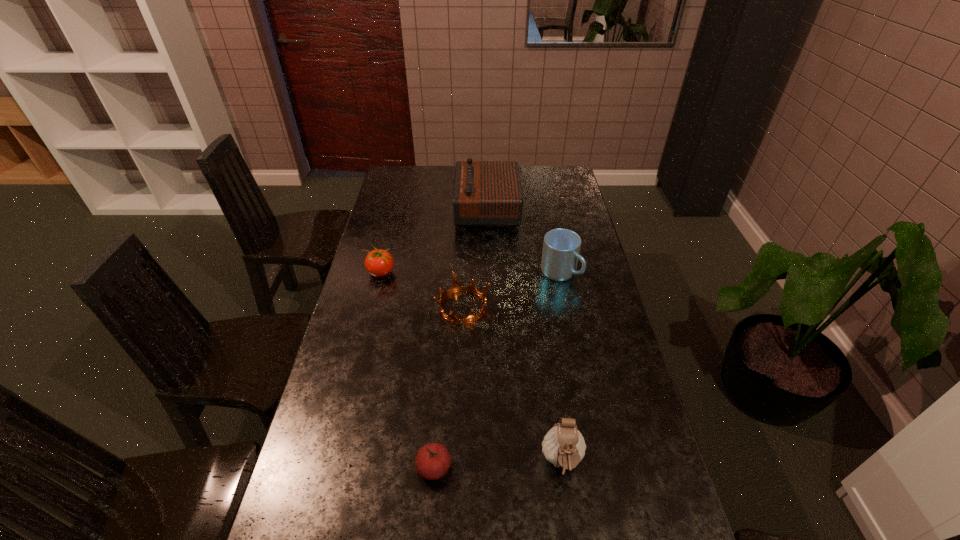
Identify the location of free space that is in between the mug and the tallest object. (523, 241).

Find the location of `vacant area between the tallest object and the pouch`. vacant area between the tallest object and the pouch is located at coordinates (524, 335).

Locate an element on the screen. unoccupied area between the mug and the crown is located at coordinates (512, 289).

You are a GUI agent. You are given a task and a screenshot of the screen. Output one action in this format:
    pyautogui.click(x=<x>, y=<y>)
    Task: Click on the second closest object to the crown
    This screenshot has height=540, width=960.
    Given the screenshot: What is the action you would take?
    pyautogui.click(x=561, y=247)

You are a GUI agent. You are given a task and a screenshot of the screen. Output one action in this format:
    pyautogui.click(x=<x>, y=<y>)
    Task: Click on the object that is the third closest to the tallest object
    The image size is (960, 540).
    Given the screenshot: What is the action you would take?
    (x=456, y=287)

Locate an element on the screen. The width and height of the screenshot is (960, 540). blank area in the image that satisfies the following two spatial constraints: 1. on the back side of the shorter tomato; 2. on the left side of the mug is located at coordinates (449, 273).

Find the location of `vacant area in the image that satisfies the following two spatial constraints: 1. on the front panel of the radio receiver; 2. on the right side of the mug`. vacant area in the image that satisfies the following two spatial constraints: 1. on the front panel of the radio receiver; 2. on the right side of the mug is located at coordinates (489, 273).

The height and width of the screenshot is (540, 960). Identify the location of free space in the image that satisfies the following two spatial constraints: 1. on the front side of the leftmost object; 2. on the left side of the crown. (372, 306).

Image resolution: width=960 pixels, height=540 pixels. Find the location of `free space that satisfies the following two spatial constraints: 1. on the front side of the shorter tomato; 2. on the right side of the taller tomato`. free space that satisfies the following two spatial constraints: 1. on the front side of the shorter tomato; 2. on the right side of the taller tomato is located at coordinates (331, 468).